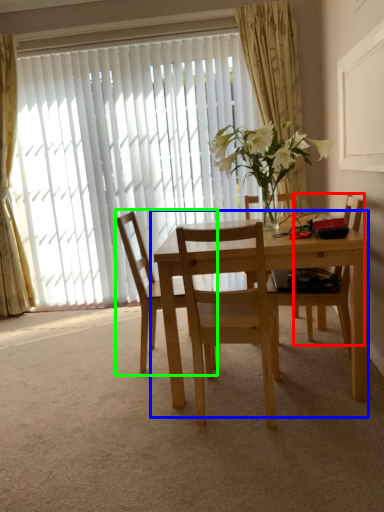
Question: Estimate the real-world distances between objects in this image. Which object is closer to chair (highlighted by a red box), kitchen & dining room table (highlighted by a blue box) or chair (highlighted by a green box)?

Choices:
 (A) kitchen & dining room table
 (B) chair

Answer: (A)